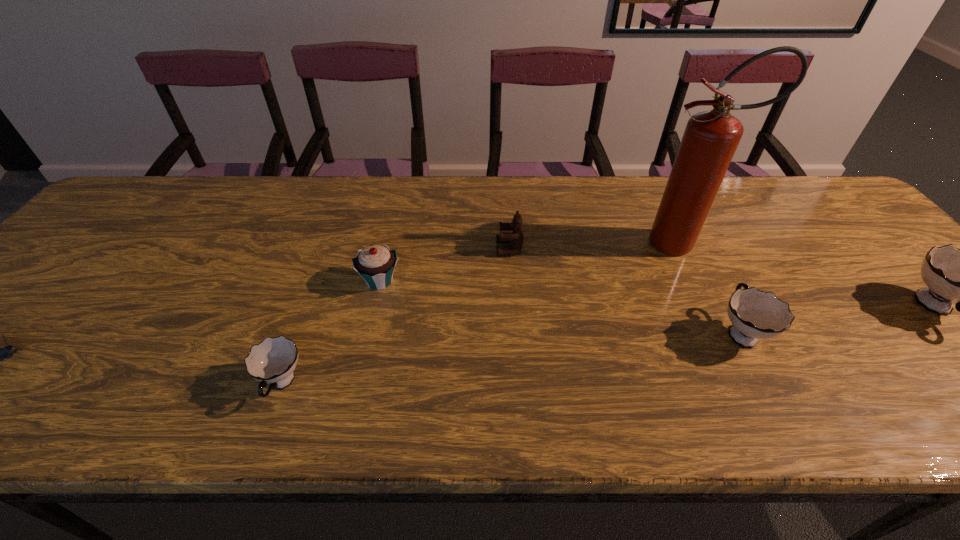
At what (x,y) coordinates should I click in order to perform the action: click on vacant space at the far right corner of the desktop. Please return your answer as a coordinate pair (x, y). Looking at the image, I should click on (831, 192).

Locate an element on the screen. This screenshot has width=960, height=540. vacant region at the near right corner is located at coordinates (951, 357).

At what (x,y) coordinates should I click in order to perform the action: click on vacant space in between the cupcake and the second cup from left to right. Please return your answer as a coordinate pair (x, y). This screenshot has width=960, height=540. Looking at the image, I should click on (560, 306).

I want to click on unoccupied area between the leftmost cup and the teddy bear, so click(x=396, y=316).

Find the location of `the sixth closest object to the escargot`. the sixth closest object to the escargot is located at coordinates (951, 274).

Identify which object is the fifth nearest to the second object from left to right. Please provide its 2D coordinates. Your answer should be formatted as a tuple, i.e. [(x, y)], where the tuple contains the x and y coordinates of a point satisfying the conditions above.

[(754, 314)]

Locate which cup ranks in proximity to the rightmost cup. Please provide its 2D coordinates. Your answer should be formatted as a tuple, i.e. [(x, y)], where the tuple contains the x and y coordinates of a point satisfying the conditions above.

[(754, 314)]

This screenshot has height=540, width=960. What are the coordinates of `the second closest cup to the second shortest cup` in the screenshot? It's located at (273, 361).

Where is `free space that satisfies the following two spatial constraints: 1. on the face of the teddy bear; 2. on the side of the second tallest cup with the handle`? free space that satisfies the following two spatial constraints: 1. on the face of the teddy bear; 2. on the side of the second tallest cup with the handle is located at coordinates (516, 332).

The height and width of the screenshot is (540, 960). What are the coordinates of `vacant area in the image that satisfies the following two spatial constraints: 1. from the nozzle of the fire extinguisher; 2. on the side of the shortest cup with the handle` in the screenshot? It's located at [751, 384].